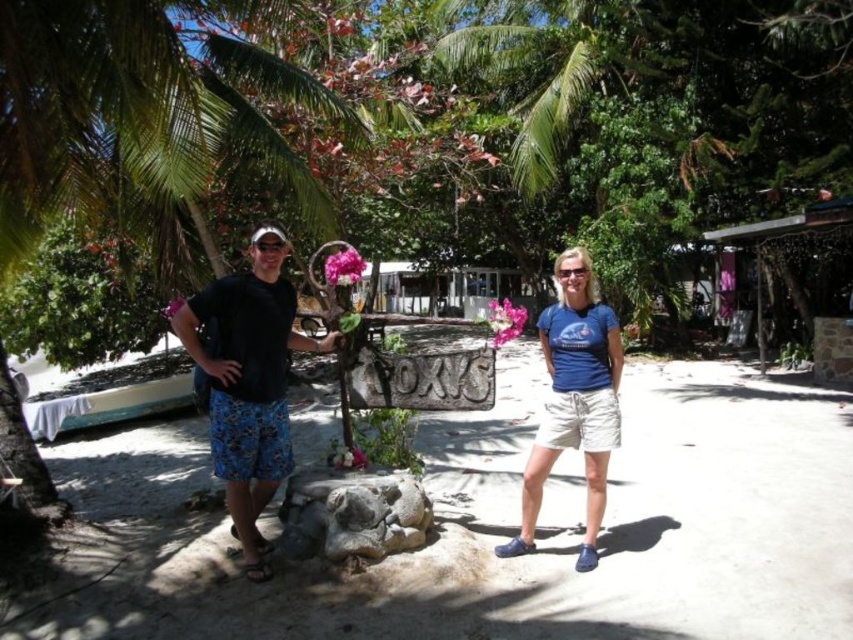
Question: Which point is farther to the camera?

Choices:
 (A) blue cotton t-shirt at center
 (B) rustic stone signpost at center

Answer: (A)

Question: Is black fabric shorts at left positioned at the back of blue cotton t-shirt at center?

Choices:
 (A) no
 (B) yes

Answer: (A)

Question: Can you confirm if rustic stone signpost at center is positioned to the left of blue cotton t-shirt at center?

Choices:
 (A) no
 (B) yes

Answer: (B)

Question: Among these objects, which one is nearest to the camera?

Choices:
 (A) blue cotton t-shirt at center
 (B) transparent plastic goggles at center
 (C) black fabric shorts at left
 (D) rustic stone signpost at center

Answer: (D)

Question: Does blue cotton t-shirt at center come behind transparent plastic goggles at center?

Choices:
 (A) yes
 (B) no

Answer: (B)

Question: Which point is closer to the camera?

Choices:
 (A) (595, 518)
 (B) (560, 268)
 (C) (282, 244)

Answer: (C)